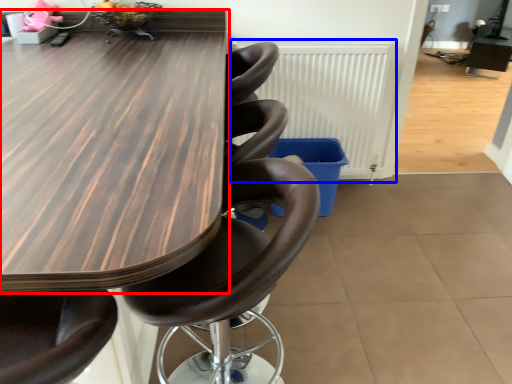
Question: Which point is closer to the camera, table (highlighted by a red box) or radiator (highlighted by a blue box)?

Choices:
 (A) table
 (B) radiator

Answer: (A)